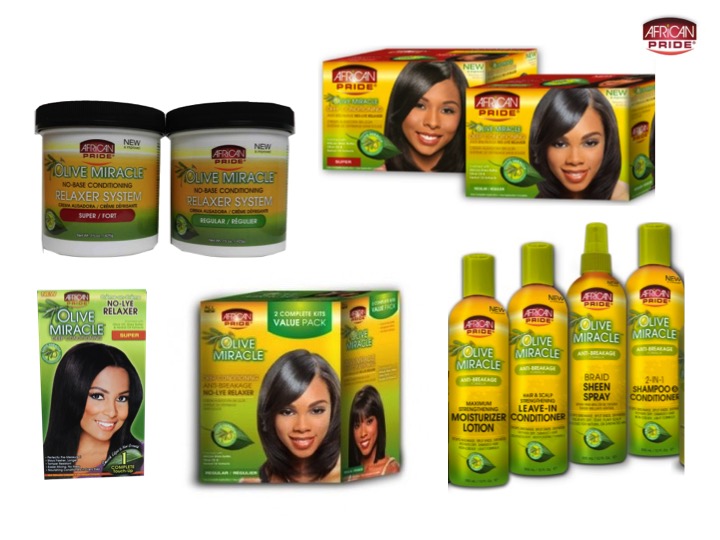
Where is `boxes`? boxes is located at coordinates (78, 348), (230, 359), (382, 128), (505, 156).